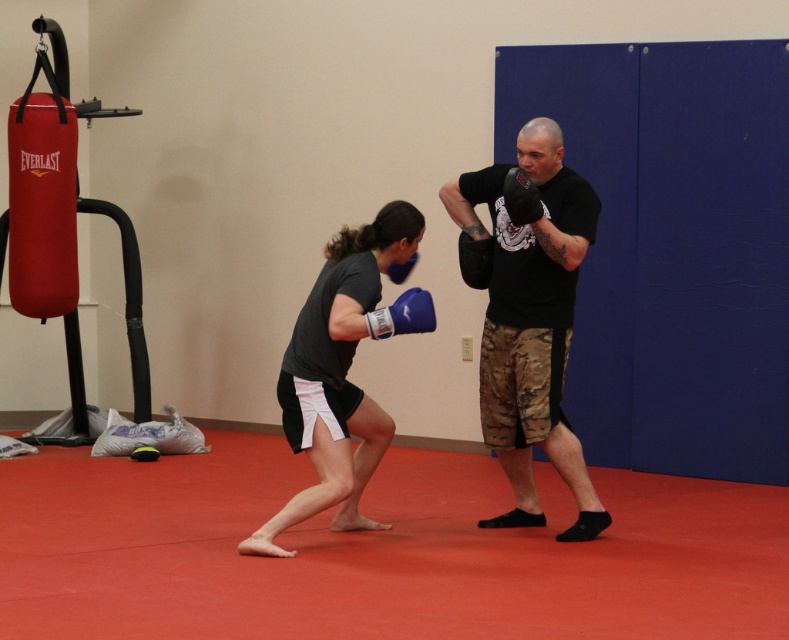
You are a boxer preparing for a match and need to choose between the matte blue boxing glove at center and the blue synthetic boxing glove at center. Based on their width, which one would you recommend for a punch that requires more surface area?

The matte blue boxing glove at center is wider than the blue synthetic boxing glove at center, so it would provide more surface area for the punch.